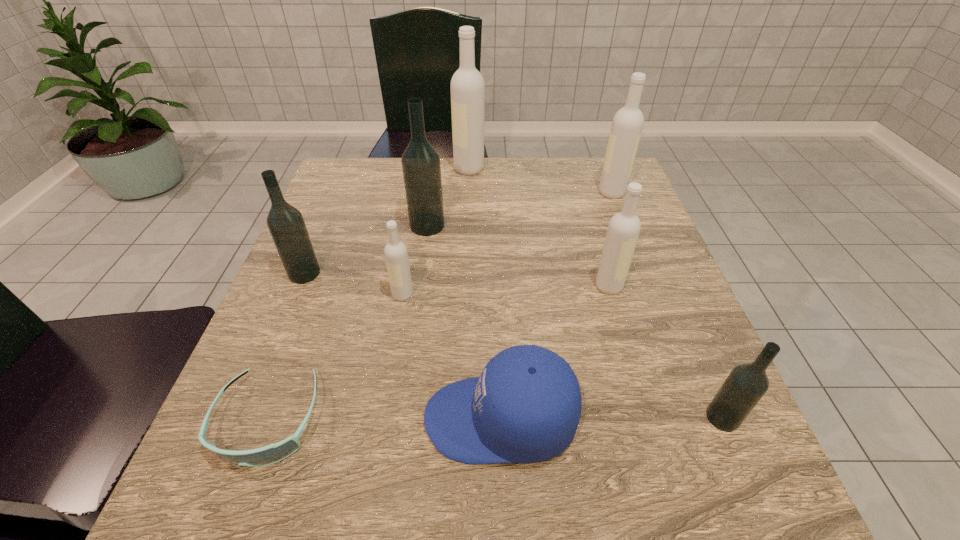
Where is `object at the near left corner`? The width and height of the screenshot is (960, 540). object at the near left corner is located at coordinates (273, 453).

You are a GUI agent. You are given a task and a screenshot of the screen. Output one action in this format:
    pyautogui.click(x=<x>, y=<y>)
    Task: Click on the object that is at the far right corner
    The height and width of the screenshot is (540, 960).
    Given the screenshot: What is the action you would take?
    pyautogui.click(x=627, y=124)

The height and width of the screenshot is (540, 960). I want to click on vacant area at the far edge of the desktop, so click(x=396, y=188).

At what (x,y) coordinates should I click in order to perform the action: click on vacant space at the right edge of the desktop. Please return your answer as a coordinate pair (x, y). Image resolution: width=960 pixels, height=540 pixels. Looking at the image, I should click on (684, 420).

Locate an element on the screen. The height and width of the screenshot is (540, 960). free space at the far left corner of the desktop is located at coordinates (372, 164).

You are a GUI agent. You are given a task and a screenshot of the screen. Output one action in this format:
    pyautogui.click(x=<x>, y=<y>)
    Task: Click on the vacant space at the near left corner of the desktop
    This screenshot has height=540, width=960.
    Given the screenshot: What is the action you would take?
    pyautogui.click(x=215, y=471)

The height and width of the screenshot is (540, 960). I want to click on vacant space at the far right corner of the desktop, so click(x=580, y=181).

In the image, there is a desktop. Where is `vacant space at the near right corner`? The width and height of the screenshot is (960, 540). vacant space at the near right corner is located at coordinates (745, 461).

You are a GUI agent. You are given a task and a screenshot of the screen. Output one action in this format:
    pyautogui.click(x=<x>, y=<y>)
    Task: Click on the free spot between the smallest white vodka and the seventh nearest object
    
    Given the screenshot: What is the action you would take?
    pyautogui.click(x=415, y=260)

Identify the location of free spot between the third white vodka from left to right and the smallest white vodka. (506, 291).